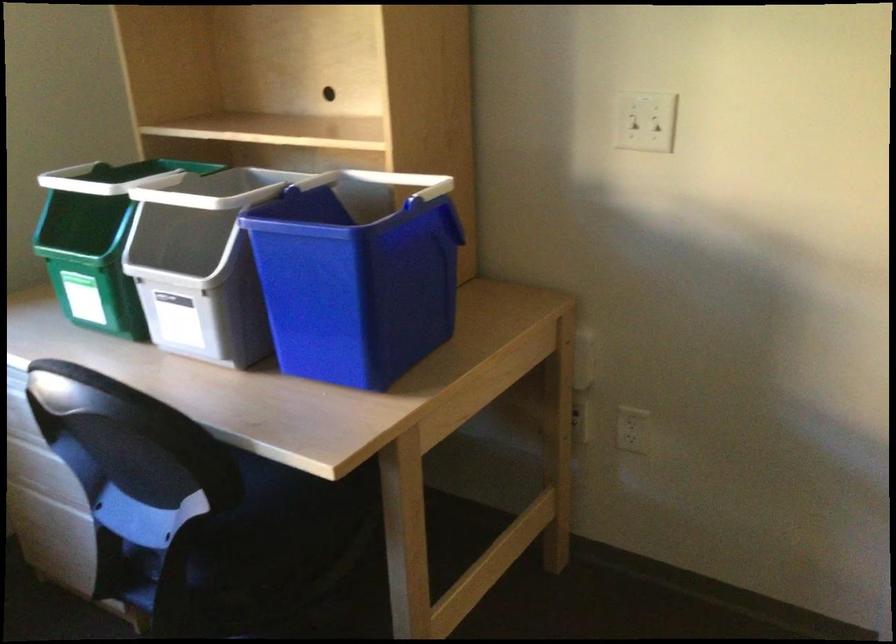
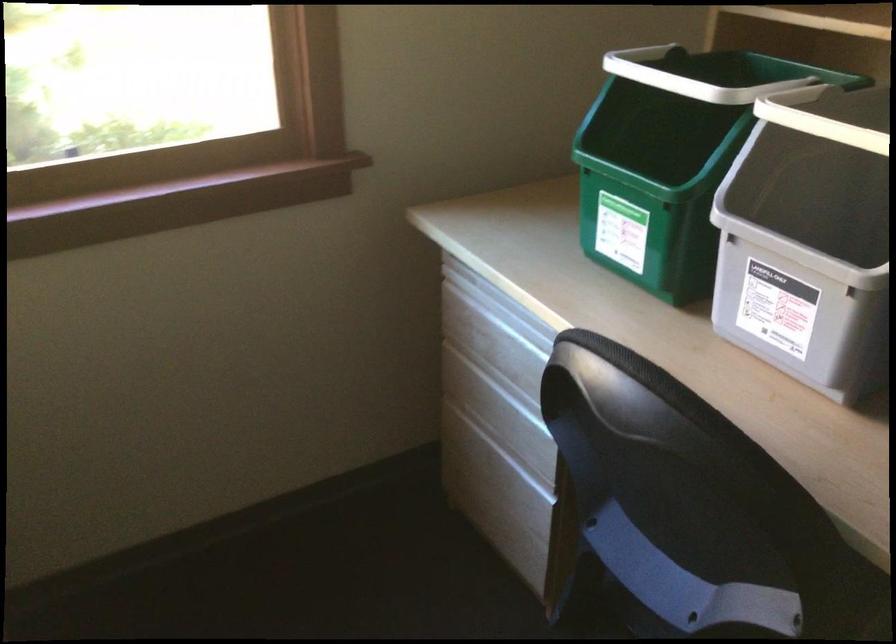
Question: Based on the continuous images, in which direction is the camera rotating? Reply with the corresponding letter.

Choices:
 (A) Left
 (B) Right
 (C) Up
 (D) Down

Answer: (A)